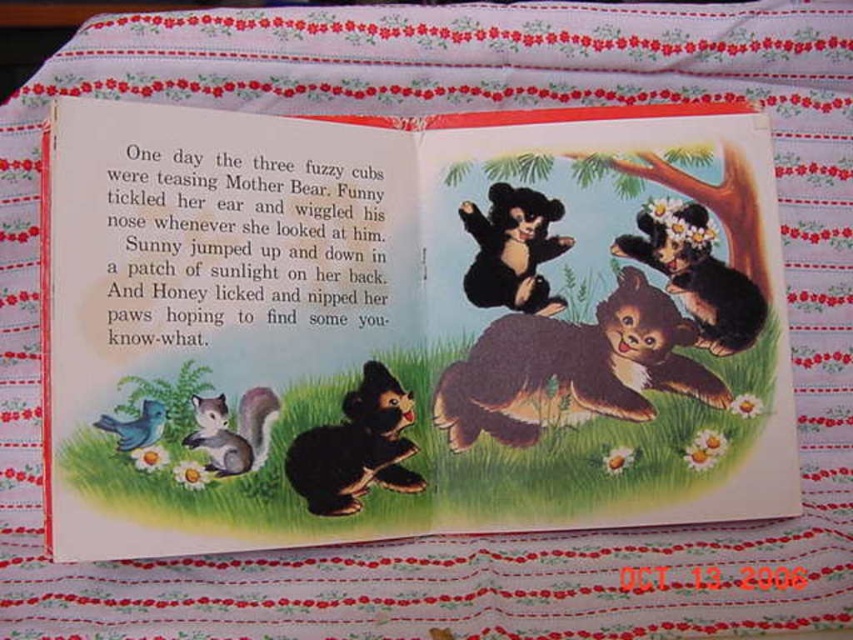
Is shiny black bear at lower center below gray furry squirrel at lower left?

Indeed, shiny black bear at lower center is positioned under gray furry squirrel at lower left.

Image resolution: width=853 pixels, height=640 pixels. Identify the location of shiny black bear at lower center. pos(357,448).

You are a GUI agent. You are given a task and a screenshot of the screen. Output one action in this format:
    pyautogui.click(x=<x>, y=<y>)
    Task: Click on the shiny black bear at lower center
    
    Given the screenshot: What is the action you would take?
    357,448

Which is above, black matte bear at upper center or blue matte bird at lower left?

Positioned higher is black matte bear at upper center.

Between black matte bear at upper center and blue matte bird at lower left, which one is positioned lower?

blue matte bird at lower left is below.

Measure the distance between point (469, 278) and camera.

A distance of 3.92 feet exists between point (469, 278) and camera.

Where is `black matte bear at upper center`? black matte bear at upper center is located at coordinates (514, 250).

Describe the element at coordinates (409, 324) in the screenshot. I see `shiny black bear at upper right` at that location.

In the scene shown: Can you confirm if shiny black bear at upper right is bigger than brown furry bear at center?

Yes.

Where is `shiny black bear at upper right`? The width and height of the screenshot is (853, 640). shiny black bear at upper right is located at coordinates (409, 324).

At what (x,y) coordinates should I click in order to perform the action: click on shiny black bear at upper right. Please return your answer as a coordinate pair (x, y). The image size is (853, 640). Looking at the image, I should click on (409, 324).